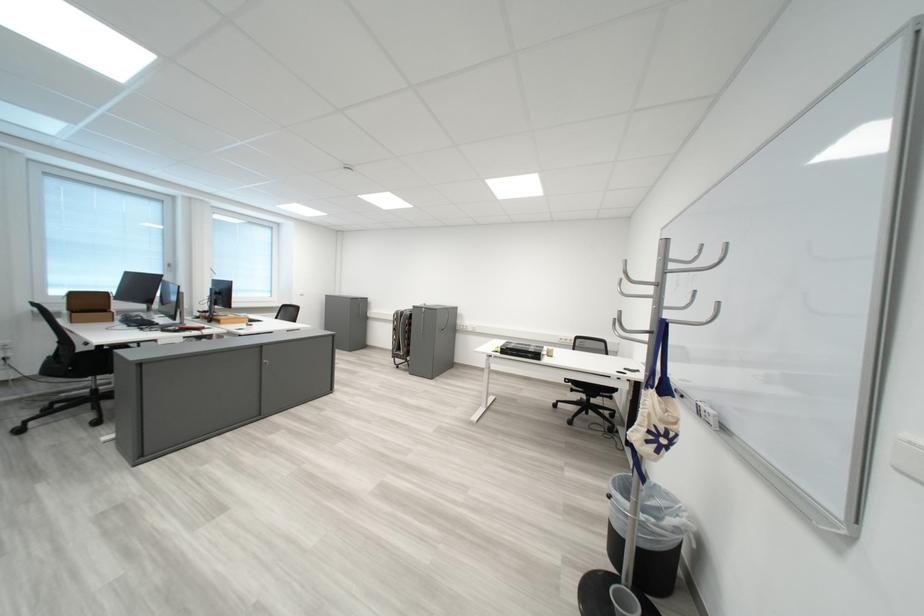
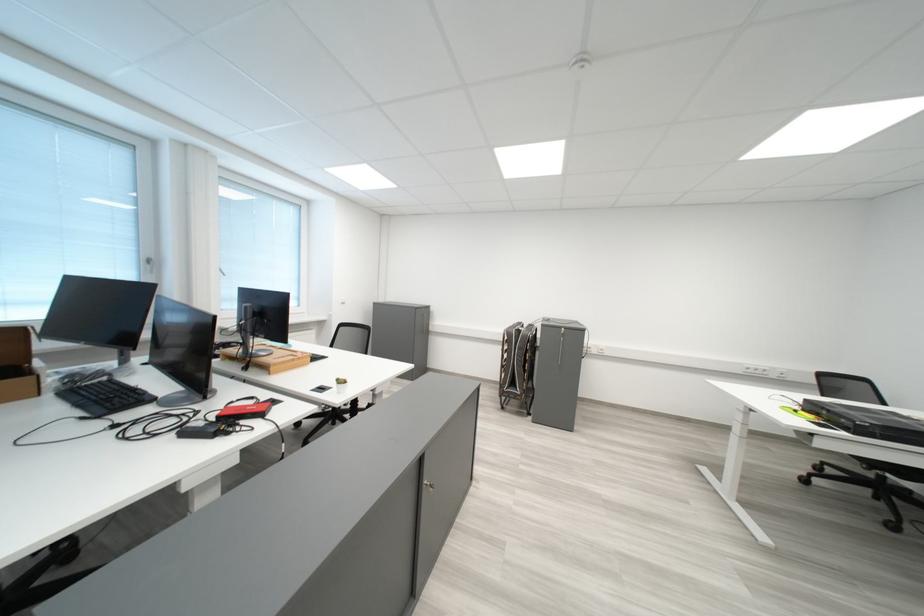
In the scene shown: Which direction would the cameraman need to move to produce the second image?

The movement direction of the cameraman is left, forward.